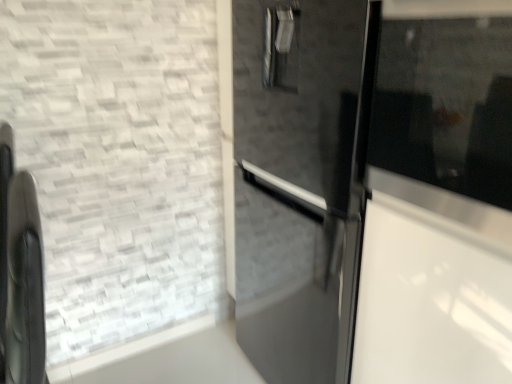
Question: Is black matte chair at left oriented away from transparent glass door at right?

Choices:
 (A) no
 (B) yes

Answer: (A)

Question: Is black matte chair at left smaller than transparent glass door at right?

Choices:
 (A) yes
 (B) no

Answer: (B)

Question: Does black matte chair at left appear on the left side of transparent glass door at right?

Choices:
 (A) yes
 (B) no

Answer: (A)

Question: Can you confirm if black matte chair at left is positioned to the right of transparent glass door at right?

Choices:
 (A) yes
 (B) no

Answer: (B)

Question: Does black matte chair at left have a greater height compared to transparent glass door at right?

Choices:
 (A) yes
 (B) no

Answer: (A)

Question: Is black matte chair at left positioned before transparent glass door at right?

Choices:
 (A) yes
 (B) no

Answer: (B)

Question: Does transparent glass door at right turn towards black matte chair at left?

Choices:
 (A) yes
 (B) no

Answer: (B)

Question: Can you confirm if transparent glass door at right is taller than black matte chair at left?

Choices:
 (A) no
 (B) yes

Answer: (A)

Question: Is transparent glass door at right next to black matte chair at left?

Choices:
 (A) yes
 (B) no

Answer: (B)

Question: Are transparent glass door at right and black matte chair at left far apart?

Choices:
 (A) yes
 (B) no

Answer: (B)

Question: Does transparent glass door at right have a lesser width compared to black matte chair at left?

Choices:
 (A) no
 (B) yes

Answer: (A)

Question: Considering the relative sizes of transparent glass door at right and black matte chair at left in the image provided, is transparent glass door at right shorter than black matte chair at left?

Choices:
 (A) yes
 (B) no

Answer: (A)

Question: From a real-world perspective, relative to transparent glass door at right, is black matte chair at left vertically above or below?

Choices:
 (A) below
 (B) above

Answer: (A)